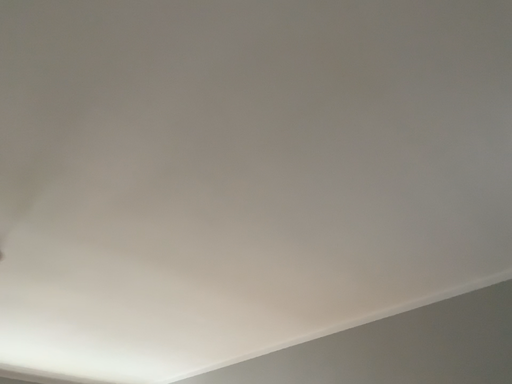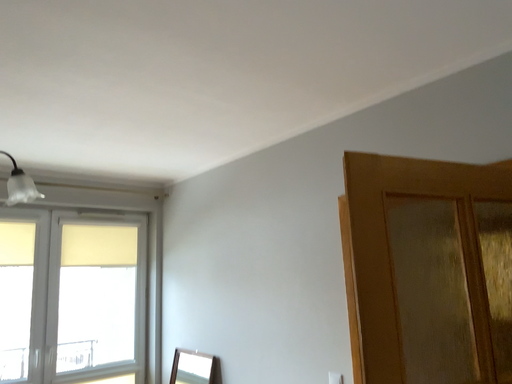
Question: How did the camera likely rotate when shooting the video?

Choices:
 (A) rotated downward
 (B) rotated upward

Answer: (A)